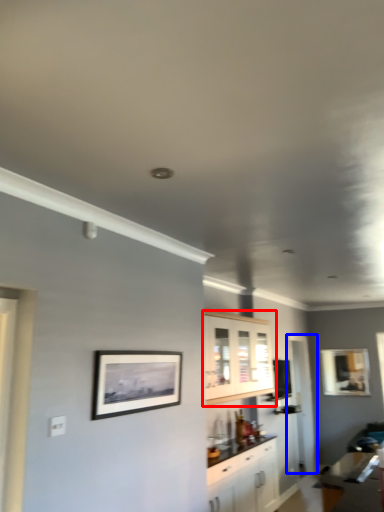
Question: Among these objects, which one is farthest to the camera, cabinetry (highlighted by a red box) or glass door (highlighted by a blue box)?

Choices:
 (A) cabinetry
 (B) glass door

Answer: (B)